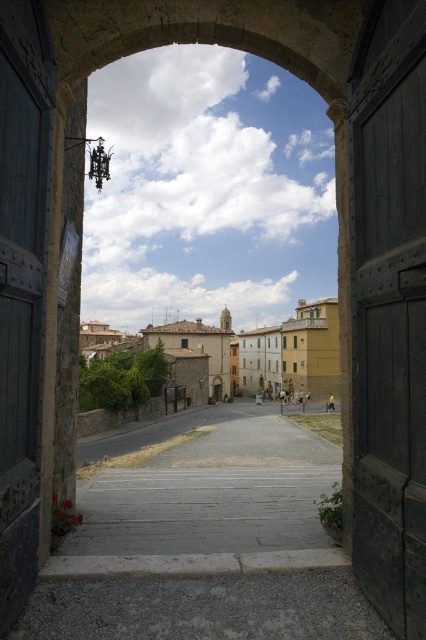
Can you confirm if dark wood door at right is wider than beige stone buildings at center?

In fact, dark wood door at right might be narrower than beige stone buildings at center.

In the scene shown: Can you confirm if dark wood door at right is taller than beige stone buildings at center?

Incorrect, dark wood door at right's height is not larger of beige stone buildings at center's.

What do you see at coordinates (388, 312) in the screenshot? The height and width of the screenshot is (640, 426). I see `dark wood door at right` at bounding box center [388, 312].

Locate an element on the screen. dark wood door at right is located at coordinates (388, 312).

Is dark wood door at left above beige stone buildings at center?

Correct, dark wood door at left is located above beige stone buildings at center.

Does dark wood door at left have a greater width compared to beige stone buildings at center?

No, dark wood door at left is not wider than beige stone buildings at center.

Where is `dark wood door at left`? Image resolution: width=426 pixels, height=640 pixels. dark wood door at left is located at coordinates (22, 289).

Does gray stone alley at center come in front of dark wood door at left?

That is False.

Is gray stone alley at center bigger than dark wood door at left?

Indeed, gray stone alley at center has a larger size compared to dark wood door at left.

Which is in front, point (224, 484) or point (25, 332)?

Point (25, 332) is more forward.

Find the location of a particular element. gray stone alley at center is located at coordinates (210, 486).